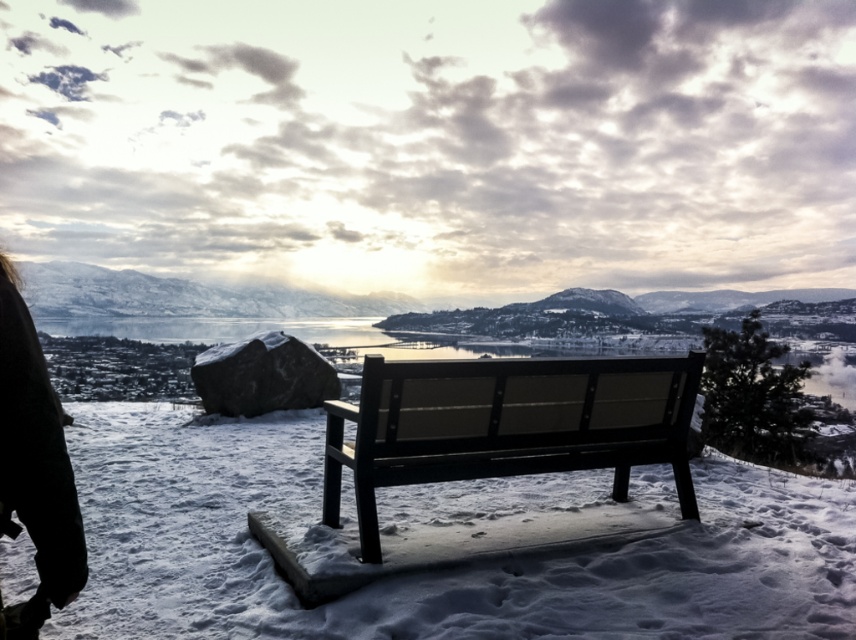
Is white powdery snow at center taller than black fabric at lower left?

In fact, white powdery snow at center may be shorter than black fabric at lower left.

Who is more forward, (331, 637) or (82, 568)?

Point (82, 568) is more forward.

Does point (798, 490) come behind point (0, 481)?

Yes, it is behind point (0, 481).

Find the location of a particular element. The height and width of the screenshot is (640, 856). white powdery snow at center is located at coordinates (423, 576).

Does white powdery snow at center have a lesser width compared to matte black bench at center?

Correct, white powdery snow at center's width is less than matte black bench at center's.

Who is taller, white powdery snow at center or matte black bench at center?

Standing taller between the two is matte black bench at center.

Is point (229, 451) more distant than point (654, 410)?

That is True.

Locate an element on the screen. The width and height of the screenshot is (856, 640). white powdery snow at center is located at coordinates [423, 576].

Is point (633, 420) positioned after point (28, 605)?

Yes, point (633, 420) is behind point (28, 605).

Does point (383, 369) come in front of point (4, 264)?

No, it is not.

This screenshot has width=856, height=640. I want to click on matte black bench at center, so click(x=508, y=424).